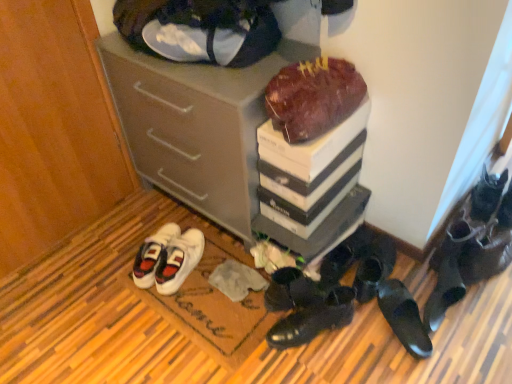
Find the location of a particular element. The image size is (512, 384). vacant area situated to the left side of matte gray cabinet at center is located at coordinates (108, 241).